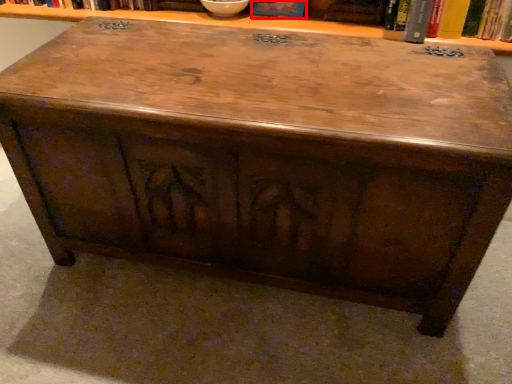
Question: Considering the relative positions of book (annotated by the red box) and book in the image provided, where is book (annotated by the red box) located with respect to the staircase?

Choices:
 (A) left
 (B) right

Answer: (A)